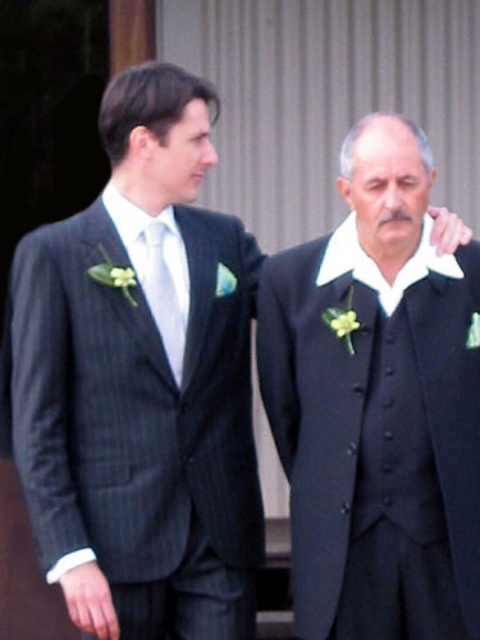
Question: Which point is closer to the camera?

Choices:
 (A) click(384, 324)
 (B) click(120, 200)

Answer: (A)

Question: Among these objects, which one is nearest to the camera?

Choices:
 (A) pinstripe fabric suit at left
 (B) matte silver tie at center

Answer: (A)

Question: Can you confirm if pinstripe fabric suit at left is thinner than matte silver tie at center?

Choices:
 (A) no
 (B) yes

Answer: (A)

Question: From the image, what is the correct spatial relationship of pinstripe fabric suit at left in relation to matte silver tie at center?

Choices:
 (A) above
 (B) below

Answer: (B)

Question: Can you confirm if pinstripe fabric suit at left is bigger than matte silver tie at center?

Choices:
 (A) yes
 (B) no

Answer: (A)

Question: Which object is the closest to the black textured suit at center?

Choices:
 (A) pinstripe fabric suit at left
 (B) matte silver tie at center

Answer: (A)